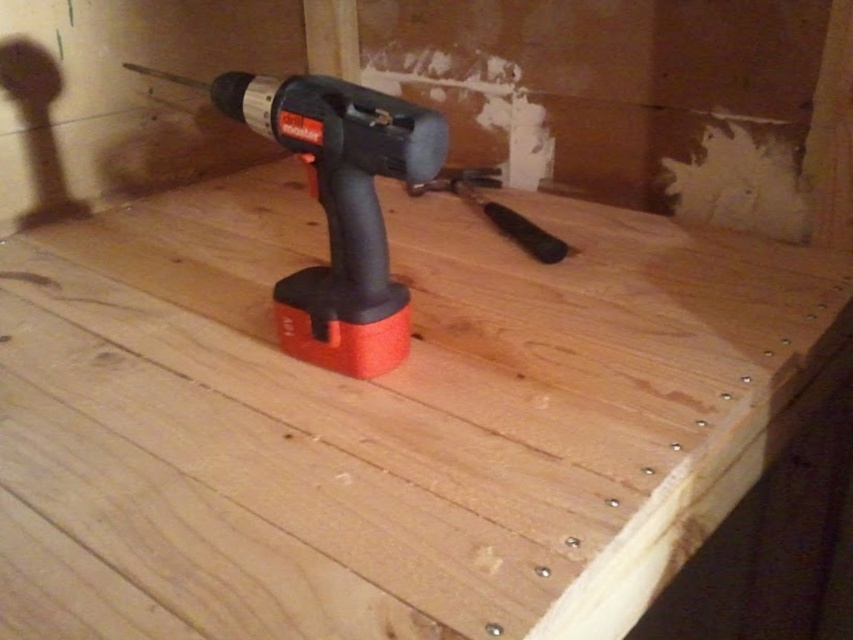
Question: Is wooden table at center closer to the viewer compared to red plastic drill at center?

Choices:
 (A) no
 (B) yes

Answer: (B)

Question: Is wooden table at center smaller than red plastic drill at center?

Choices:
 (A) yes
 (B) no

Answer: (B)

Question: Which point is closer to the camera?

Choices:
 (A) wooden table at center
 (B) red plastic drill at center

Answer: (A)

Question: Is wooden table at center above red plastic drill at center?

Choices:
 (A) yes
 (B) no

Answer: (B)

Question: Which of the following is the closest to the observer?

Choices:
 (A) (265, 134)
 (B) (741, 401)

Answer: (B)